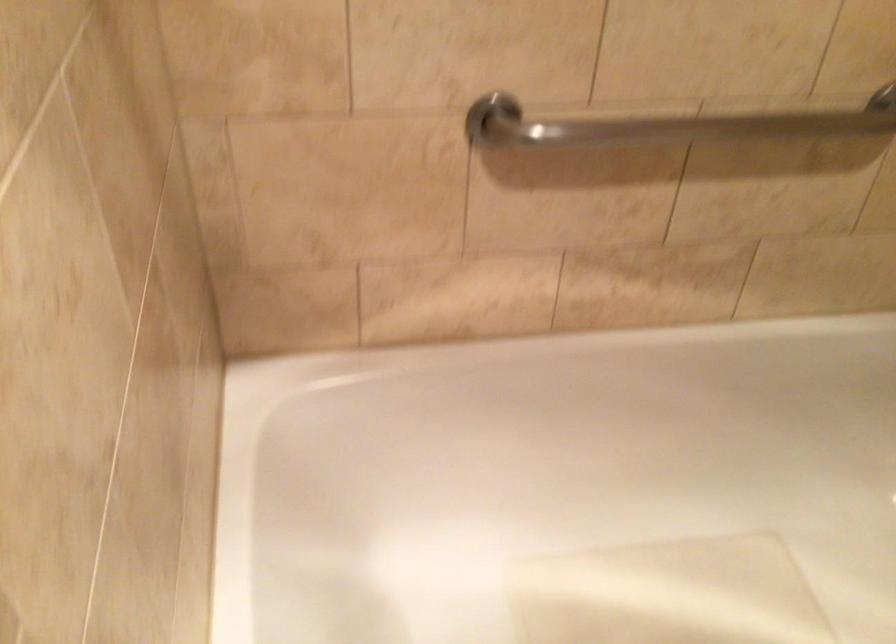
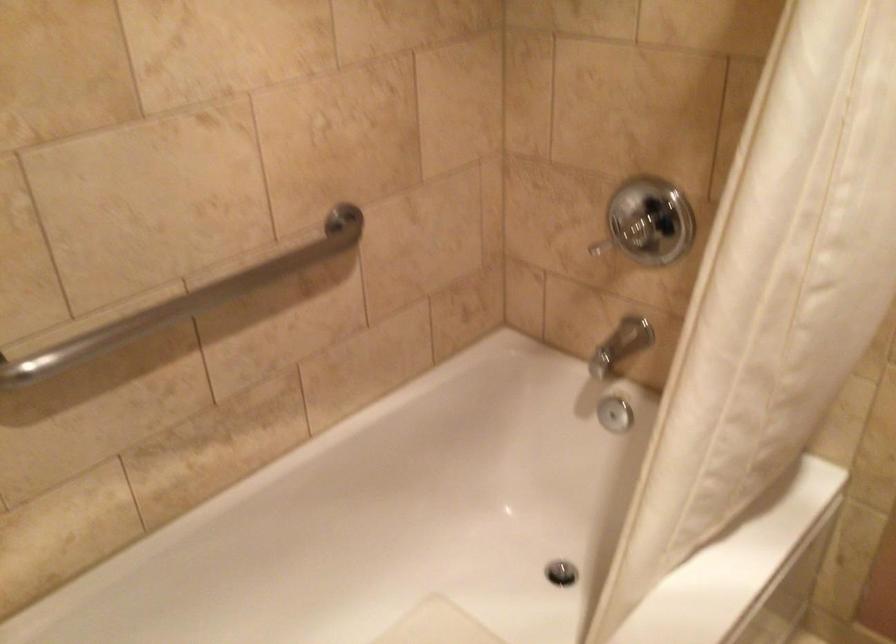
The point at (693, 124) is marked in the first image. Where is the corresponding point in the second image?

(185, 301)